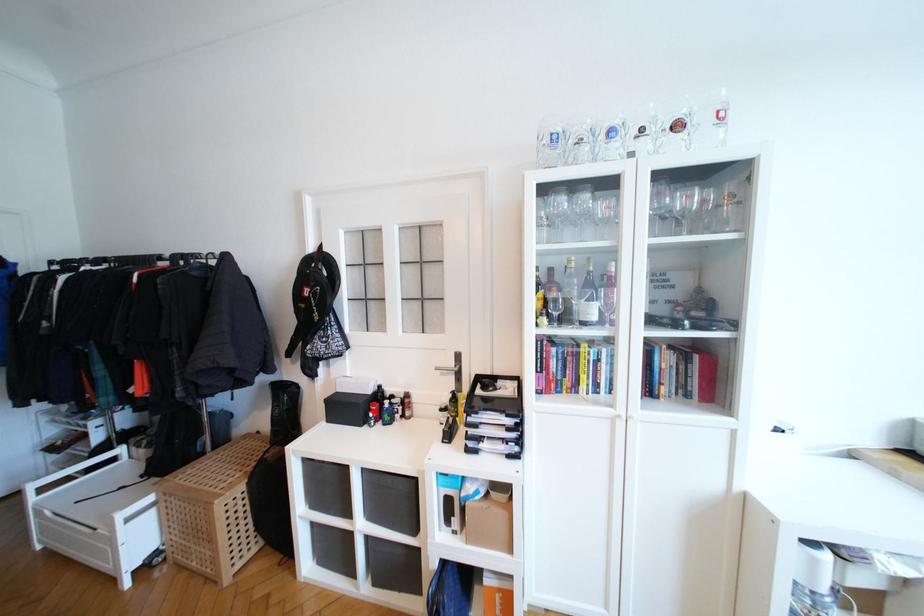
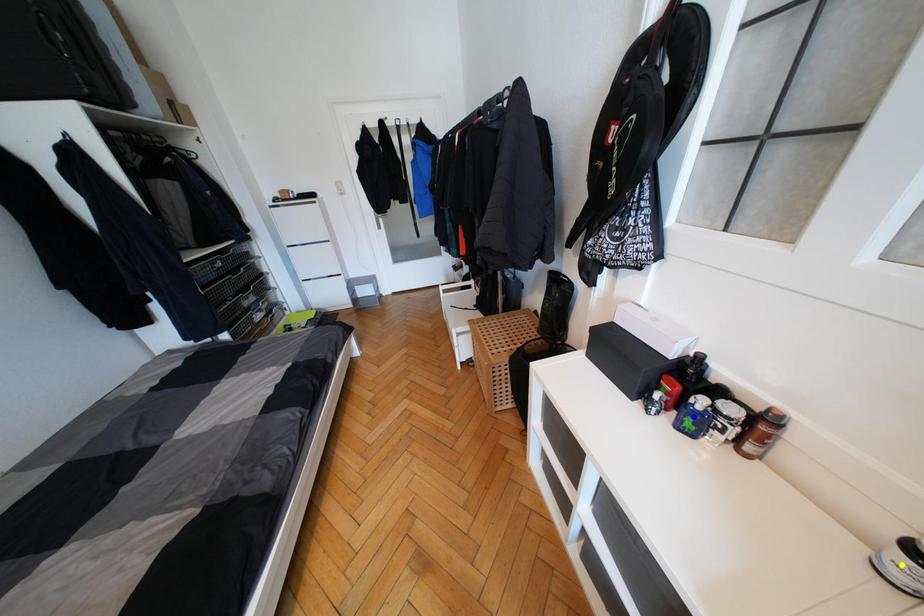
Question: I am providing you with two images of the same scene from different viewpoints. A red point is marked on the first image. You are given multiple points on the second image. In image 2, which mark is for the same physical point as the one in image 1?

Choices:
 (A) yellow point
 (B) green point
 (C) blue point

Answer: (B)